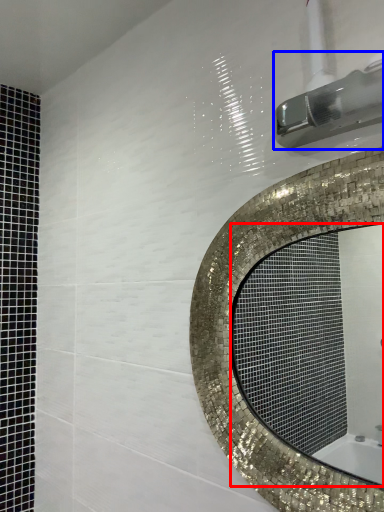
Question: Which object is further to the camera taking this photo, mirror (highlighted by a red box) or shower (highlighted by a blue box)?

Choices:
 (A) mirror
 (B) shower

Answer: (A)